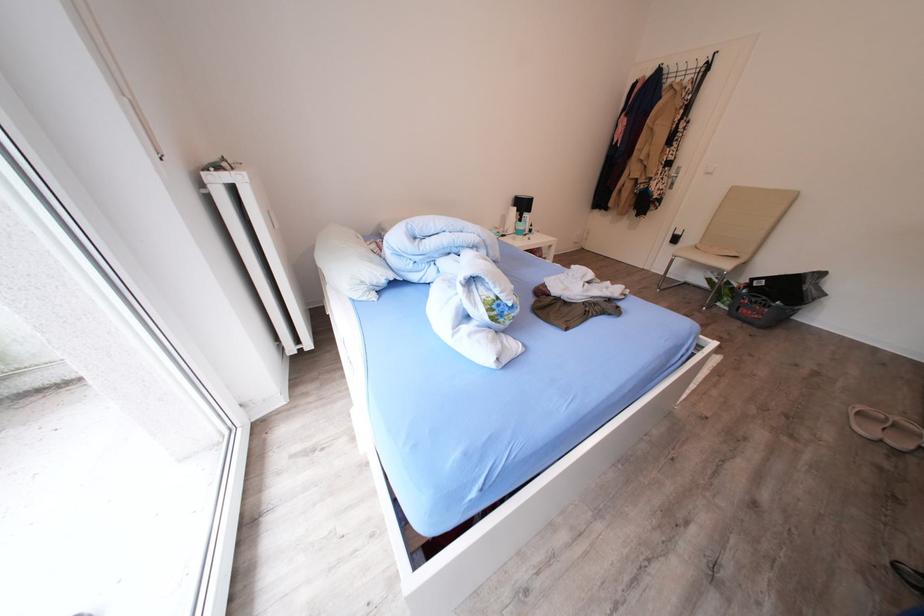
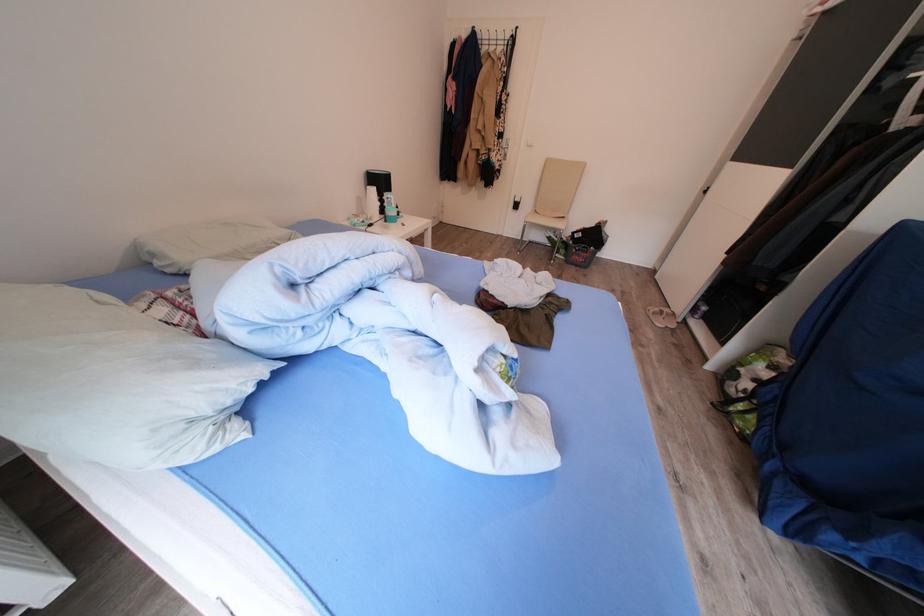
Question: The camera is either moving clockwise (left) or counter-clockwise (right) around the object. The first image is from the beginning of the video and the second image is from the end. Is the camera moving left or right when shooting the video?

Choices:
 (A) Left
 (B) Right

Answer: (A)